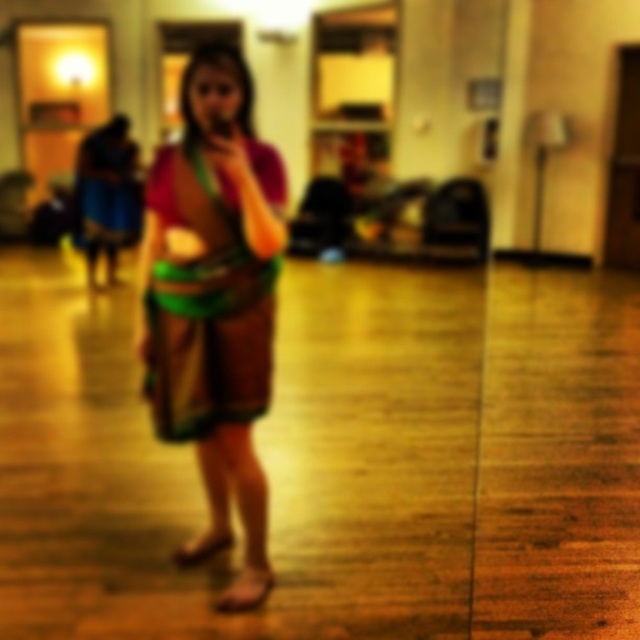
You are standing in the dance studio and see two points marked in the image. Which point, point (x=204, y=467) or point (x=163, y=365), is closer to you?

Point (x=204, y=467) is closer to you because it is further to the viewer than point (x=163, y=365).

You are organizing a fashion show and need to locate the matte brown dress at center. According to the coordinates provided, where exactly is it positioned in the image?

The matte brown dress at center is located at coordinates point (214, 301).